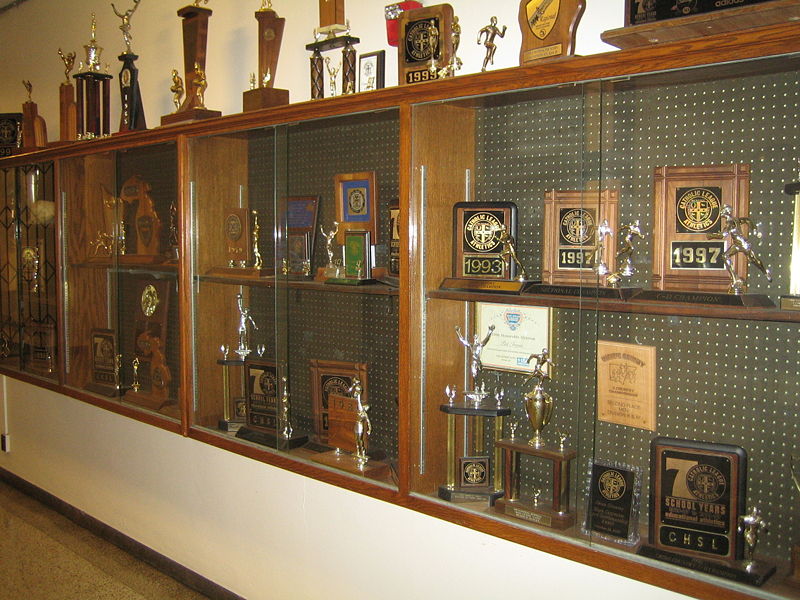
This screenshot has height=600, width=800. I want to click on award, so click(510, 359).